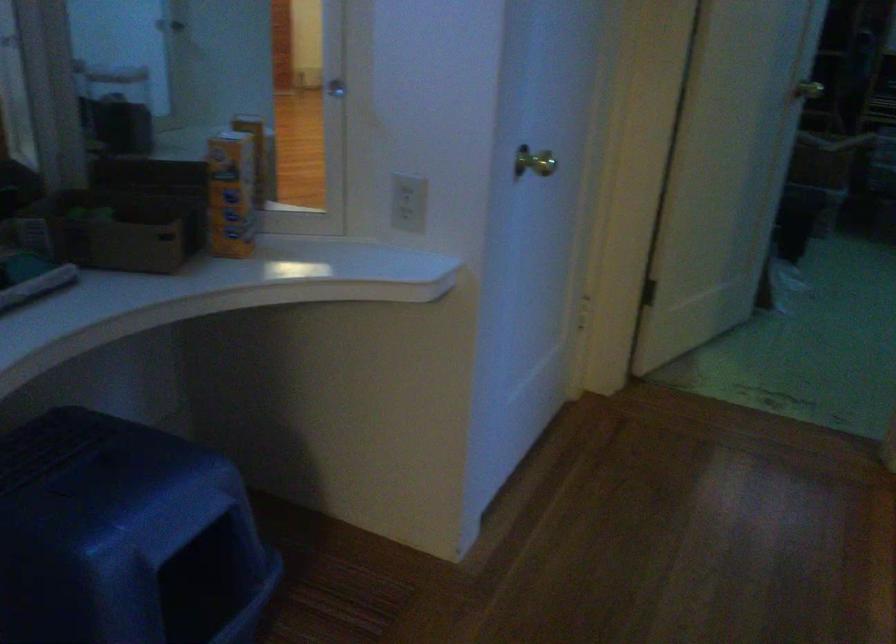
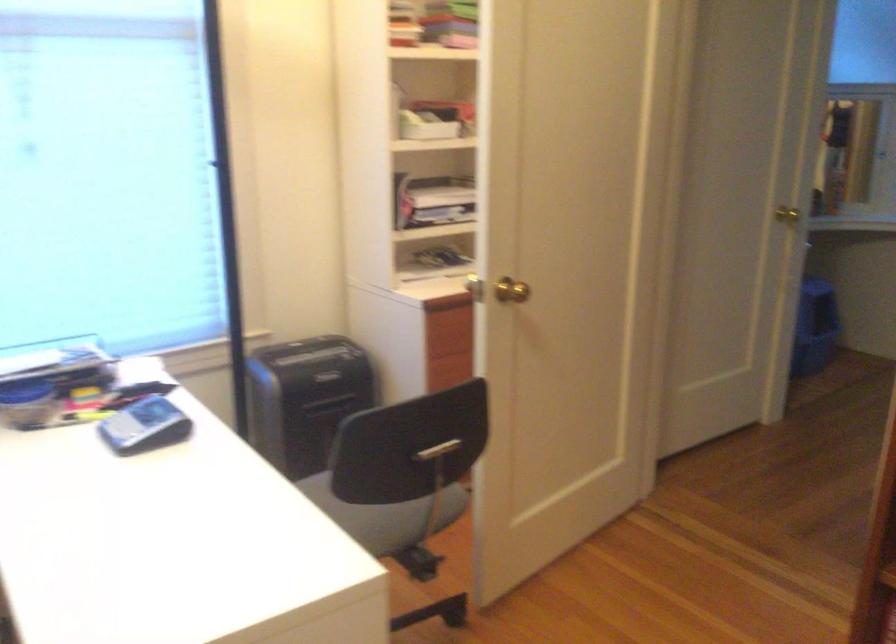
Question: I am providing you with two images of the same scene from different viewpoints. Which of the following objects are not visible in image2?

Choices:
 (A) blue litter box
 (B) chair sitting surface
 (C) blue maze knob
 (D) grey calculator

Answer: (A)